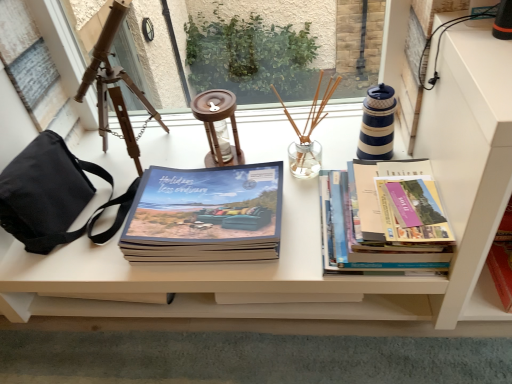
At what (x,y) coordinates should I click in order to perform the action: click on vacant space underneath wooden tripod at left (from a real-world perspective). Please return your answer as a coordinate pair (x, y). This screenshot has height=384, width=512. Looking at the image, I should click on (126, 153).